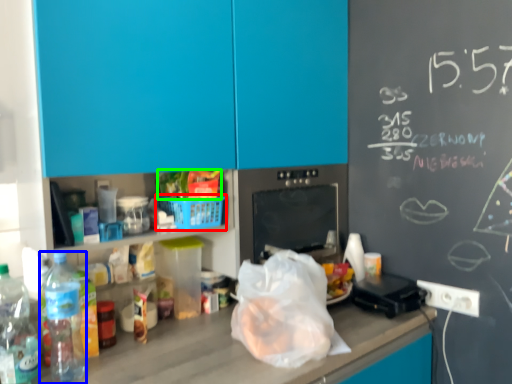
Question: Which object is positioned farthest from basket (highlighted by a red box)? Select from bottle (highlighted by a blue box) and food (highlighted by a green box).

Choices:
 (A) bottle
 (B) food

Answer: (A)